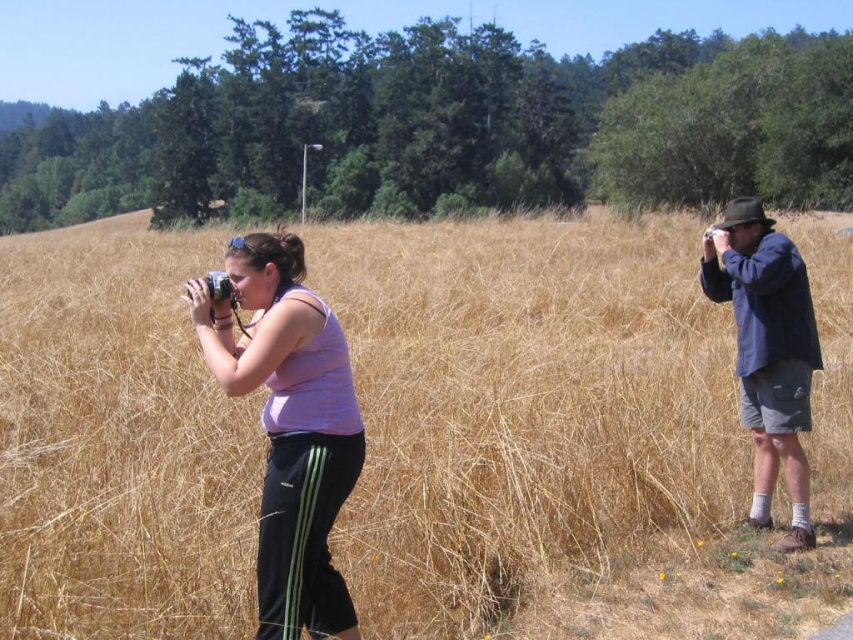
Does point (111, 522) lie in front of point (338, 600)?

No, (111, 522) is further to viewer.

Who is lower down, dry grass at center or pink fabric tank top at center?

pink fabric tank top at center is below.

Is point (697, 435) closer to camera compared to point (303, 250)?

No, it is behind (303, 250).

The height and width of the screenshot is (640, 853). I want to click on dry grass at center, so click(523, 404).

Does pink fabric tank top at center have a larger size compared to blue denim jacket at right?

Yes, pink fabric tank top at center is bigger than blue denim jacket at right.

Who is positioned more to the right, pink fabric tank top at center or blue denim jacket at right?

From the viewer's perspective, blue denim jacket at right appears more on the right side.

What do you see at coordinates (289, 428) in the screenshot? The image size is (853, 640). I see `pink fabric tank top at center` at bounding box center [289, 428].

Locate an element on the screen. pink fabric tank top at center is located at coordinates (289, 428).

Between dry grass at center and blue denim jacket at right, which one has more height?

Standing taller between the two is dry grass at center.

Does dry grass at center come behind blue denim jacket at right?

No, it is not.

Where is `dry grass at center`? The height and width of the screenshot is (640, 853). dry grass at center is located at coordinates (523, 404).

Image resolution: width=853 pixels, height=640 pixels. Find the location of `dry grass at center`. dry grass at center is located at coordinates (523, 404).